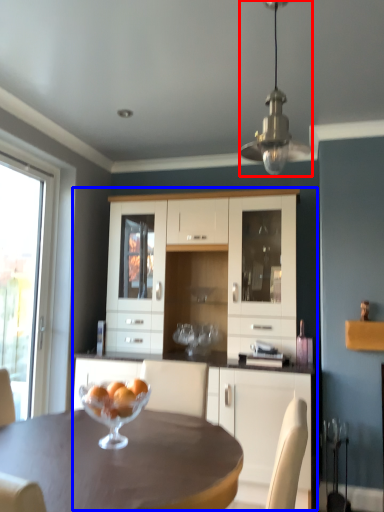
Question: Among these objects, which one is nearest to the camera, lamp (highlighted by a red box) or cupboard (highlighted by a blue box)?

Choices:
 (A) lamp
 (B) cupboard

Answer: (A)